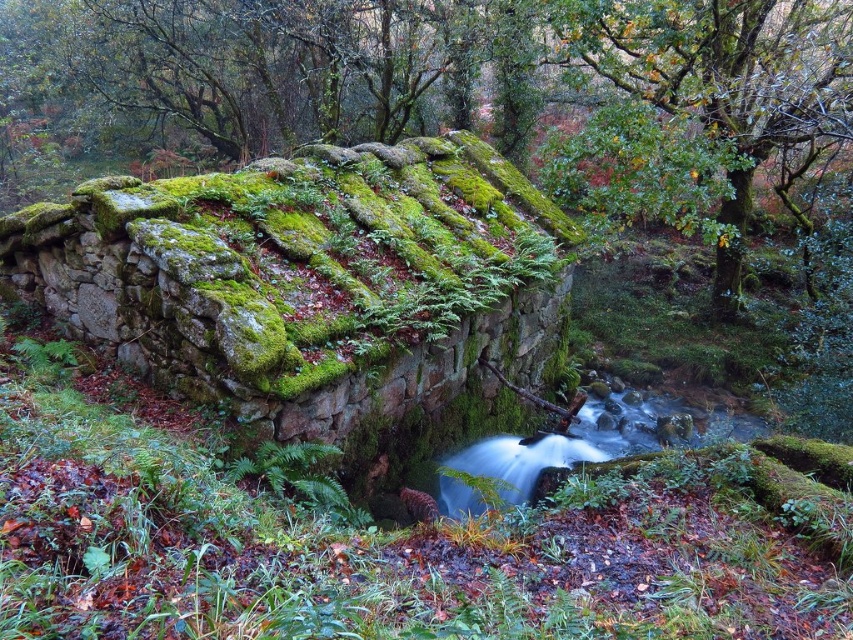
Question: Does green mossy stone wall at center have a lesser width compared to clear water at center?

Choices:
 (A) yes
 (B) no

Answer: (B)

Question: Which of the following is the farthest from the observer?

Choices:
 (A) clear water at center
 (B) green mossy stone wall at center

Answer: (A)

Question: Which object appears farthest from the camera in this image?

Choices:
 (A) green mossy stone wall at center
 (B) clear water at center

Answer: (B)

Question: Which of the following is the closest to the observer?

Choices:
 (A) clear water at center
 (B) green mossy stone wall at center

Answer: (B)

Question: Considering the relative positions of green mossy stone wall at center and clear water at center in the image provided, where is green mossy stone wall at center located with respect to clear water at center?

Choices:
 (A) above
 (B) below

Answer: (A)

Question: Is the position of green mossy stone wall at center more distant than that of clear water at center?

Choices:
 (A) yes
 (B) no

Answer: (B)